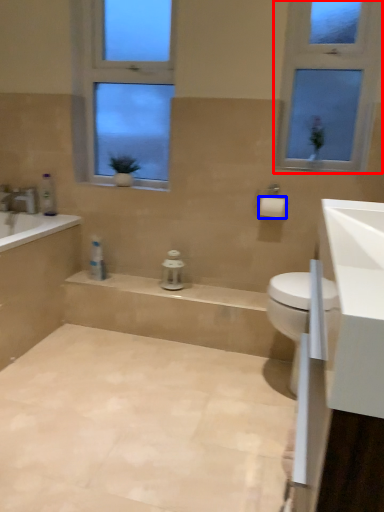
Question: Which point is further to the camera, window (highlighted by a red box) or toilet paper (highlighted by a blue box)?

Choices:
 (A) window
 (B) toilet paper

Answer: (B)